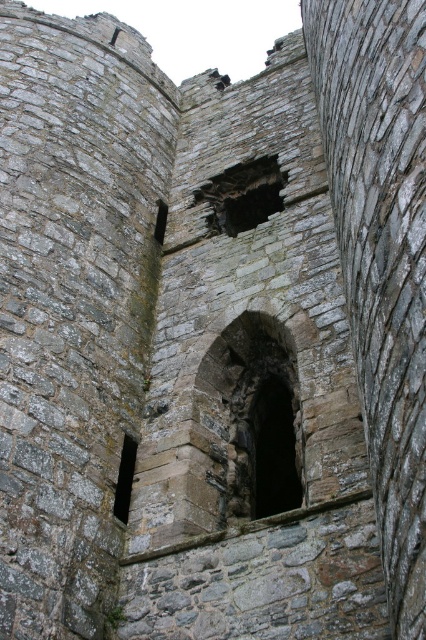
Question: Can you confirm if dark stone hole at center is smaller than dark stone window at lower left?

Choices:
 (A) no
 (B) yes

Answer: (A)

Question: Is rough stone archway at center in front of dark stone hole at center?

Choices:
 (A) no
 (B) yes

Answer: (B)

Question: Does rough stone archway at center have a lesser width compared to dark stone window at lower left?

Choices:
 (A) yes
 (B) no

Answer: (B)

Question: Which point is farther to the camera?

Choices:
 (A) rough stone archway at center
 (B) dark stone hole at center
 (C) dark stone window at lower left

Answer: (B)

Question: Among these objects, which one is farthest from the camera?

Choices:
 (A) rough stone archway at center
 (B) dark stone window at lower left

Answer: (B)

Question: Which point appears closest to the camera in this image?

Choices:
 (A) (268, 216)
 (B) (232, 435)
 (C) (135, 445)

Answer: (C)